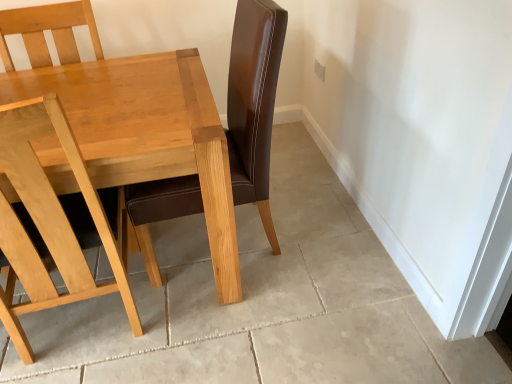
Question: Is point (237, 294) positioned closer to the camera than point (20, 216)?

Choices:
 (A) farther
 (B) closer

Answer: (A)

Question: Considering the relative positions of light wood table at center and light wood chair at left in the image provided, is light wood table at center to the left or to the right of light wood chair at left?

Choices:
 (A) left
 (B) right

Answer: (A)

Question: From the image's perspective, is light wood table at center above or below light wood chair at left?

Choices:
 (A) above
 (B) below

Answer: (A)

Question: Looking at the image, does light wood chair at left seem bigger or smaller compared to light wood table at center?

Choices:
 (A) small
 (B) big

Answer: (A)

Question: From the image's perspective, is light wood chair at left positioned above or below light wood table at center?

Choices:
 (A) below
 (B) above

Answer: (A)

Question: From a real-world perspective, is light wood chair at left above or below light wood table at center?

Choices:
 (A) above
 (B) below

Answer: (A)

Question: Is point 10,283 positioned closer to the camera than point 80,140?

Choices:
 (A) farther
 (B) closer

Answer: (A)